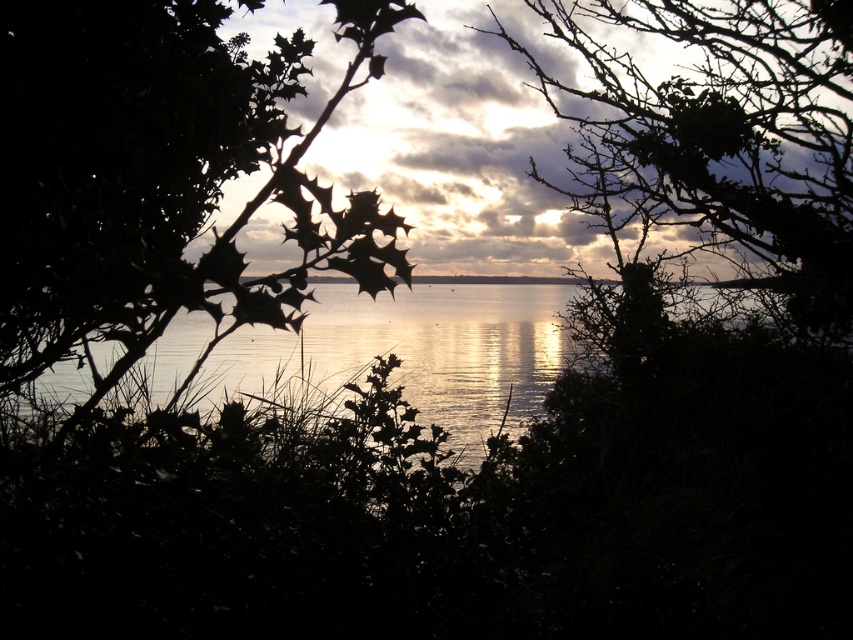
What do you see at coordinates (463, 144) in the screenshot?
I see `cloudy sky at center` at bounding box center [463, 144].

Which is in front, point (488, 262) or point (436, 288)?

Positioned in front is point (436, 288).

Where is `cloudy sky at center`? The height and width of the screenshot is (640, 853). cloudy sky at center is located at coordinates (463, 144).